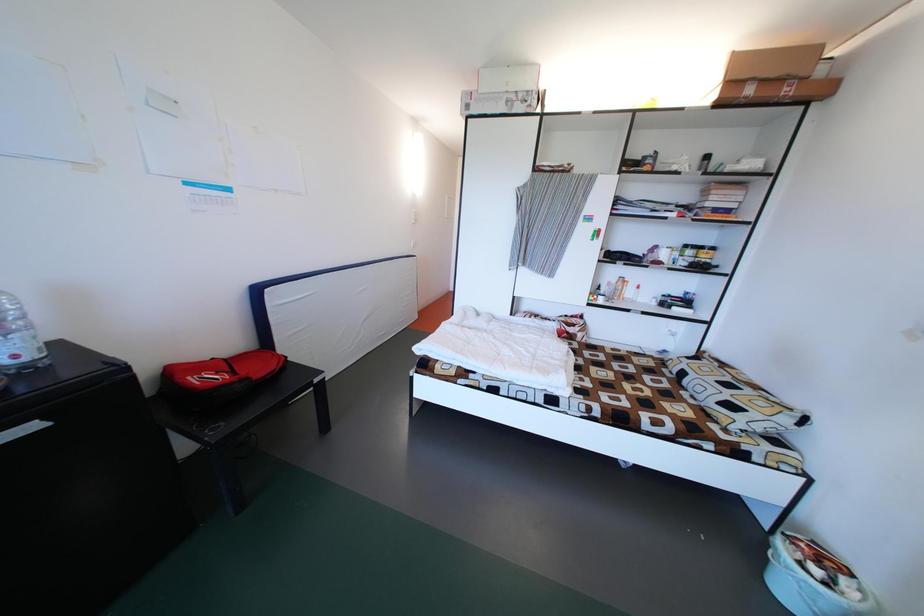
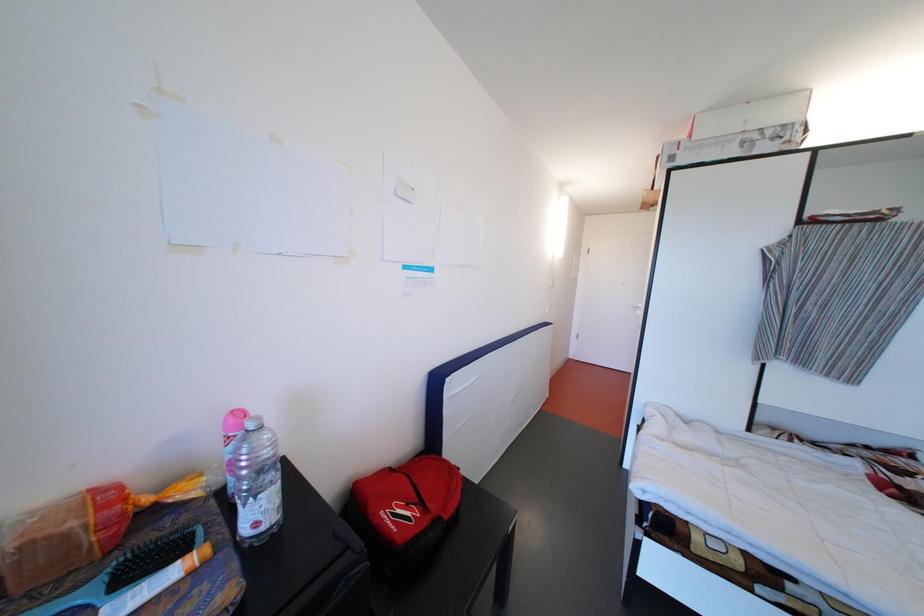
In a continuous first-person perspective shot, in which direction is the camera moving?

The cameraman walked toward left, forward.